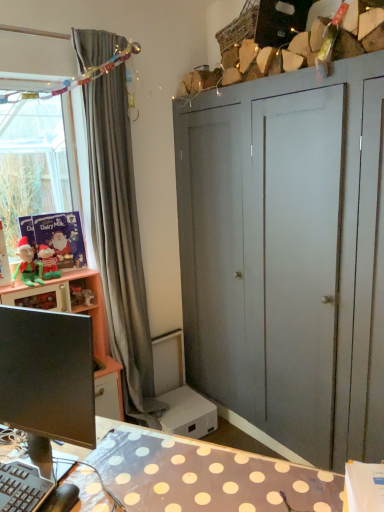
You are a GUI agent. You are given a task and a screenshot of the screen. Output one action in this format:
    pyautogui.click(x=<x>, y=<y>)
    Task: Click on the matte gray wardrobe at upper right
    The width and height of the screenshot is (384, 512).
    Given the screenshot: What is the action you would take?
    pyautogui.click(x=288, y=255)

What do you see at coordinates (22, 487) in the screenshot?
I see `black plastic keyboard at lower left` at bounding box center [22, 487].

What do you see at coordinates (47, 374) in the screenshot?
I see `black glossy monitor at lower left` at bounding box center [47, 374].

The height and width of the screenshot is (512, 384). What do you see at coordinates (28, 264) in the screenshot? I see `green plush elf at left` at bounding box center [28, 264].

The width and height of the screenshot is (384, 512). I want to click on matte gray wardrobe at upper right, so click(x=288, y=255).

Locate an element on the screen. This screenshot has width=384, height=512. computer keyboard located underneath the matte gray wardrobe at upper right (from a real-world perspective) is located at coordinates (22, 487).

Between black plastic keyboard at lower left and matte gray wardrobe at upper right, which one appears on the left side from the viewer's perspective?

From the viewer's perspective, black plastic keyboard at lower left appears more on the left side.

Is black plastic keyboard at lower left far away from matte gray wardrobe at upper right?

Yes, black plastic keyboard at lower left and matte gray wardrobe at upper right are located far from each other.

How much distance is there between black plastic keyboard at lower left and matte gray wardrobe at upper right?

A distance of 4.96 feet exists between black plastic keyboard at lower left and matte gray wardrobe at upper right.

Is point (40, 496) behind point (18, 254)?

No, it is not.

Is there a large distance between black plastic keyboard at lower left and green plush elf at left?

Yes, black plastic keyboard at lower left and green plush elf at left are quite far apart.

From the image's perspective, who appears lower, black plastic keyboard at lower left or green plush elf at left?

From the image's view, black plastic keyboard at lower left is below.

From a real-world perspective, is black plastic keyboard at lower left positioned under green plush elf at left based on gravity?

Yes, from a real-world perspective, black plastic keyboard at lower left is below green plush elf at left.

Where is `curtain that is above the green plush elf at left (from the image's perspective)`? Image resolution: width=384 pixels, height=512 pixels. curtain that is above the green plush elf at left (from the image's perspective) is located at coordinates (120, 241).

Is gray fabric curtain at left shorter than green plush elf at left?

Incorrect, the height of gray fabric curtain at left does not fall short of that of green plush elf at left.

Is gray fabric curtain at left facing towards green plush elf at left?

No, gray fabric curtain at left is not facing towards green plush elf at left.

Is gray fabric curtain at left situated inside green plush elf at left or outside?

gray fabric curtain at left cannot be found inside green plush elf at left.

Is black plastic keyboard at lower left taller or shorter than gray fabric curtain at left?

Considering their sizes, black plastic keyboard at lower left has less height than gray fabric curtain at left.

Is gray fabric curtain at left at the back of black plastic keyboard at lower left?

black plastic keyboard at lower left does not have its back to gray fabric curtain at left.

Identify the location of curtain behind the black plastic keyboard at lower left. Image resolution: width=384 pixels, height=512 pixels. (120, 241).

Would you say black plastic keyboard at lower left is to the left or to the right of gray fabric curtain at left in the picture?

In the image, black plastic keyboard at lower left appears on the left side of gray fabric curtain at left.

Is matte gray wardrobe at upper right wider than green plush elf at left?

Yes, matte gray wardrobe at upper right is wider than green plush elf at left.

Considering the sizes of objects matte gray wardrobe at upper right and green plush elf at left in the image provided, who is taller, matte gray wardrobe at upper right or green plush elf at left?

matte gray wardrobe at upper right is taller.

Is matte gray wardrobe at upper right facing towards green plush elf at left?

Yes.

Is matte gray wardrobe at upper right inside the boundaries of green plush elf at left, or outside?

matte gray wardrobe at upper right is outside green plush elf at left.

Is gray fabric curtain at left oriented towards green plush elf at left?

No, gray fabric curtain at left does not turn towards green plush elf at left.

In terms of size, does gray fabric curtain at left appear bigger or smaller than green plush elf at left?

Clearly, gray fabric curtain at left is larger in size than green plush elf at left.

Is gray fabric curtain at left closer to camera compared to green plush elf at left?

That is True.

Is gray fabric curtain at left inside the boundaries of green plush elf at left, or outside?

gray fabric curtain at left lies outside green plush elf at left.

Based on the photo, are gray fabric curtain at left and black plastic keyboard at lower left beside each other?

No, gray fabric curtain at left is not touching black plastic keyboard at lower left.

In the scene shown: Between gray fabric curtain at left and black plastic keyboard at lower left, which one appears on the left side from the viewer's perspective?

black plastic keyboard at lower left is more to the left.

You are a GUI agent. You are given a task and a screenshot of the screen. Output one action in this format:
    pyautogui.click(x=<x>, y=<y>)
    Task: Click on the computer keyboard located on the left of matte gray wardrobe at upper right
    This screenshot has height=512, width=384.
    Given the screenshot: What is the action you would take?
    pyautogui.click(x=22, y=487)

Locate an element on the screen. Image resolution: width=384 pixels, height=512 pixels. computer keyboard on the right of green plush elf at left is located at coordinates (22, 487).

Based on their spatial positions, is black plastic keyboard at lower left or black glossy monitor at lower left closer to green plush elf at left?

black glossy monitor at lower left.

Considering their positions, is green plush elf at left positioned further to green plush elf at left than black glossy monitor at lower left?

black glossy monitor at lower left lies further to green plush elf at left than the other object.

Looking at this image, from the image, which object appears to be farther from black glossy monitor at lower left, matte gray wardrobe at upper right or black plastic keyboard at lower left?

matte gray wardrobe at upper right lies further to black glossy monitor at lower left than the other object.

In the scene shown: From the image, which object appears to be nearer to black plastic keyboard at lower left, green plush elf at left or matte gray wardrobe at upper right?

green plush elf at left lies closer to black plastic keyboard at lower left than the other object.

Considering their positions, is matte gray wardrobe at upper right positioned closer to gray fabric curtain at left than green plush elf at left?

Based on the image, green plush elf at left appears to be nearer to gray fabric curtain at left.

Estimate the real-world distances between objects in this image. Which object is closer to gray fabric curtain at left, green plush elf at left or green plush elf at left?

green plush elf at left is positioned closer to the anchor gray fabric curtain at left.

From the picture: Estimate the real-world distances between objects in this image. Which object is closer to black glossy monitor at lower left, green plush elf at left or matte gray wardrobe at upper right?

green plush elf at left is closer to black glossy monitor at lower left.

Estimate the real-world distances between objects in this image. Which object is closer to matte gray wardrobe at upper right, green plush elf at left or green plush elf at left?

The object closer to matte gray wardrobe at upper right is green plush elf at left.

Where is `curtain between black glossy monitor at lower left and matte gray wardrobe at upper right in the horizontal direction`? This screenshot has width=384, height=512. curtain between black glossy monitor at lower left and matte gray wardrobe at upper right in the horizontal direction is located at coordinates (120, 241).

In order to click on computer keyboard between green plush elf at left and matte gray wardrobe at upper right in the horizontal direction in this screenshot , I will do `click(22, 487)`.

Where is `toy located between green plush elf at left and matte gray wardrobe at upper right in the left-right direction`? This screenshot has height=512, width=384. toy located between green plush elf at left and matte gray wardrobe at upper right in the left-right direction is located at coordinates (48, 262).

Locate an element on the screen. The image size is (384, 512). computer keyboard positioned between black glossy monitor at lower left and green plush elf at left from near to far is located at coordinates (22, 487).